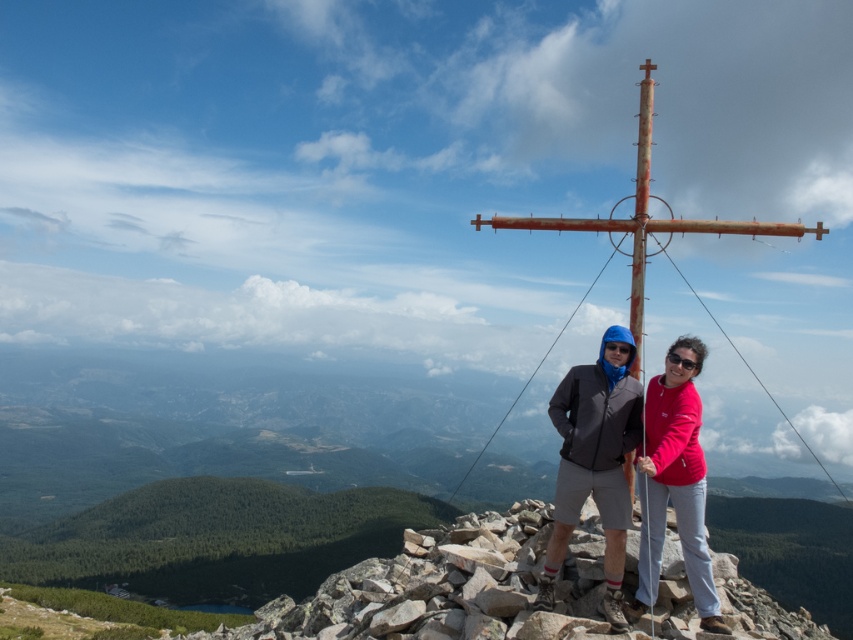
Who is higher up, matte gray jacket at center or matte pink sweatshirt at center?

matte pink sweatshirt at center is higher up.

Is matte gray jacket at center bigger than matte pink sweatshirt at center?

Indeed, matte gray jacket at center has a larger size compared to matte pink sweatshirt at center.

Identify the location of matte gray jacket at center. This screenshot has height=640, width=853. (672, 484).

Locate an element on the screen. matte gray jacket at center is located at coordinates (672, 484).